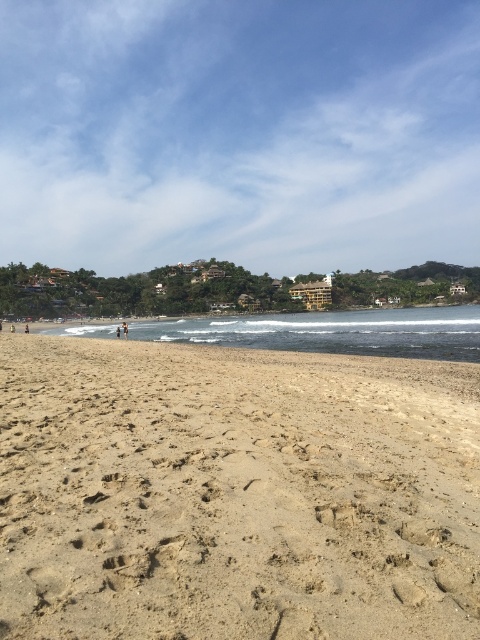
You are standing on the beach and want to walk to the water. You notice two areas of sand ahead of you. One is the light brown sandy beach at lower left and the other is the brown sand at lower left. Which area is wider and would allow more space to walk comfortably?

The light brown sandy beach at lower left is wider than the brown sand at lower left, so it would provide more space to walk comfortably.